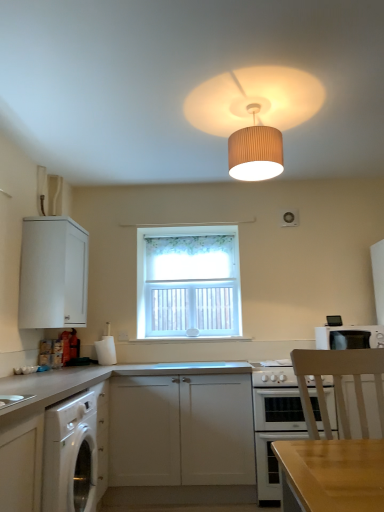
Question: In the image, is white matte cabinet at lower left, positioned as the 3th cabinetry in back-to-front order, positioned in front of or behind white glossy oven at lower center?

Choices:
 (A) behind
 (B) front

Answer: (B)

Question: In terms of height, does white matte cabinet at lower left, which appears as the 1th cabinetry when viewed from the front, look taller or shorter compared to white glossy oven at lower center?

Choices:
 (A) short
 (B) tall

Answer: (A)

Question: Estimate the real-world distances between objects in this image. Which object is closer to the white matte cabinet at left, marked as the 3th cabinetry in a front-to-back arrangement?

Choices:
 (A) light wood chair at lower right
 (B) beige pleated lampshade at upper center
 (C) white glossy exhaust hood at upper center
 (D) white matte cabinet at lower center, the 2th cabinetry viewed from the back
 (E) white glossy gas stove at lower center

Answer: (D)

Question: Which object is positioned closest to the white floral curtain at center?

Choices:
 (A) white glossy gas stove at lower center
 (B) beige pleated lampshade at upper center
 (C) white glossy microwave at upper right
 (D) floral fabric curtain at center
 (E) white matte cabinet at lower left, positioned as the 3th cabinetry in back-to-front order

Answer: (D)